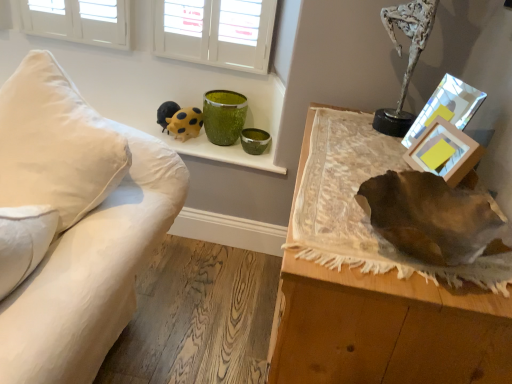
Question: Is yellow dotted plush at upper center smaller than white fabric couch at left?

Choices:
 (A) yes
 (B) no

Answer: (A)

Question: From a real-world perspective, is yellow dotted plush at upper center on white fabric couch at left?

Choices:
 (A) no
 (B) yes

Answer: (B)

Question: Is yellow dotted plush at upper center in contact with white fabric couch at left?

Choices:
 (A) yes
 (B) no

Answer: (B)

Question: Can you confirm if yellow dotted plush at upper center is shorter than white fabric couch at left?

Choices:
 (A) no
 (B) yes

Answer: (B)

Question: Is yellow dotted plush at upper center far away from white fabric couch at left?

Choices:
 (A) yes
 (B) no

Answer: (B)

Question: From the image's perspective, is green speckled glass vase at upper center above or below leather at right?

Choices:
 (A) below
 (B) above

Answer: (B)

Question: Considering the relative positions of green speckled glass vase at upper center and leather at right in the image provided, is green speckled glass vase at upper center to the left or to the right of leather at right?

Choices:
 (A) right
 (B) left

Answer: (B)

Question: Considering the positions of green speckled glass vase at upper center and leather at right in the image, is green speckled glass vase at upper center taller or shorter than leather at right?

Choices:
 (A) short
 (B) tall

Answer: (A)

Question: Is point (221, 104) positioned closer to the camera than point (293, 307)?

Choices:
 (A) farther
 (B) closer

Answer: (A)

Question: Is point (148, 180) closer or farther from the camera than point (451, 129)?

Choices:
 (A) farther
 (B) closer

Answer: (A)

Question: Considering the positions of white fabric couch at left and wooden picture frame at upper right, acting as the 2th picture frame starting from the back, in the image, is white fabric couch at left wider or thinner than wooden picture frame at upper right, acting as the 2th picture frame starting from the back,?

Choices:
 (A) thin
 (B) wide

Answer: (B)

Question: Based on their positions, is white fabric couch at left located to the left or right of wooden picture frame at upper right, acting as the 1th picture frame starting from the front?

Choices:
 (A) left
 (B) right

Answer: (A)

Question: Considering the positions of white fabric couch at left and wooden picture frame at upper right, acting as the 1th picture frame starting from the front, in the image, is white fabric couch at left bigger or smaller than wooden picture frame at upper right, acting as the 1th picture frame starting from the front,?

Choices:
 (A) small
 (B) big

Answer: (B)

Question: Does point [105, 180] appear closer or farther from the camera than point [474, 367]?

Choices:
 (A) closer
 (B) farther

Answer: (B)

Question: Which is correct: white fabric couch at left is inside leather at right, or outside of it?

Choices:
 (A) inside
 (B) outside

Answer: (B)